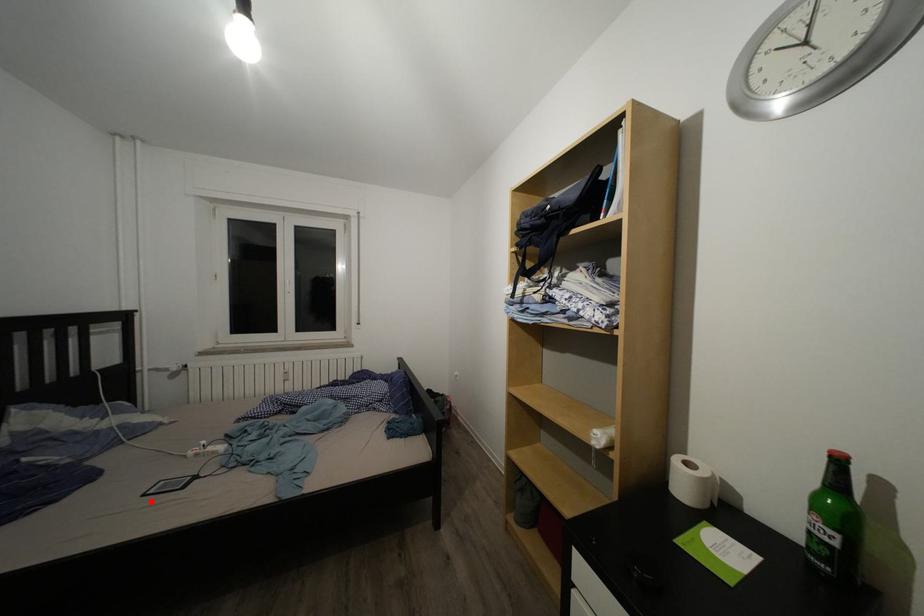
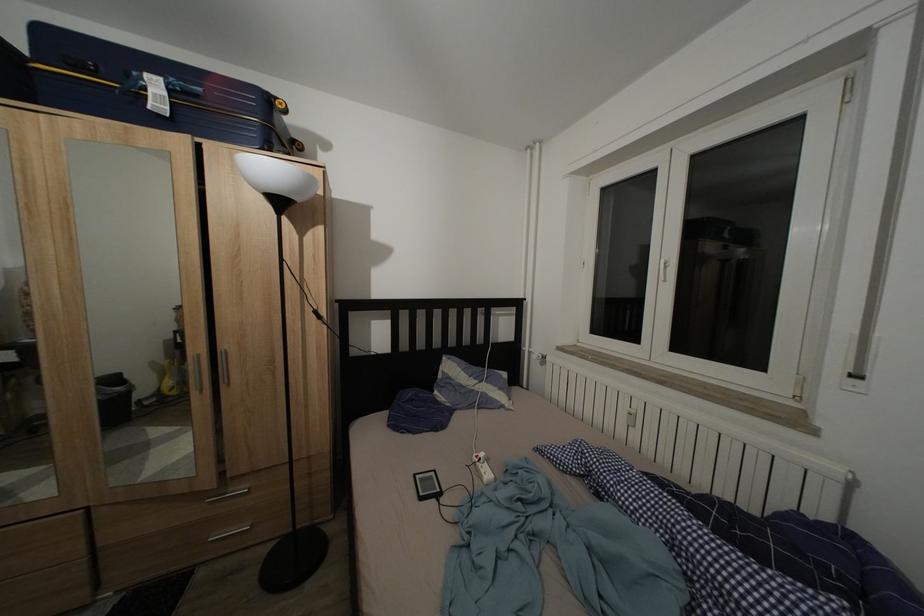
Locate, in the second image, the point that corresponds to the highlighted location in the first image.

(422, 482)